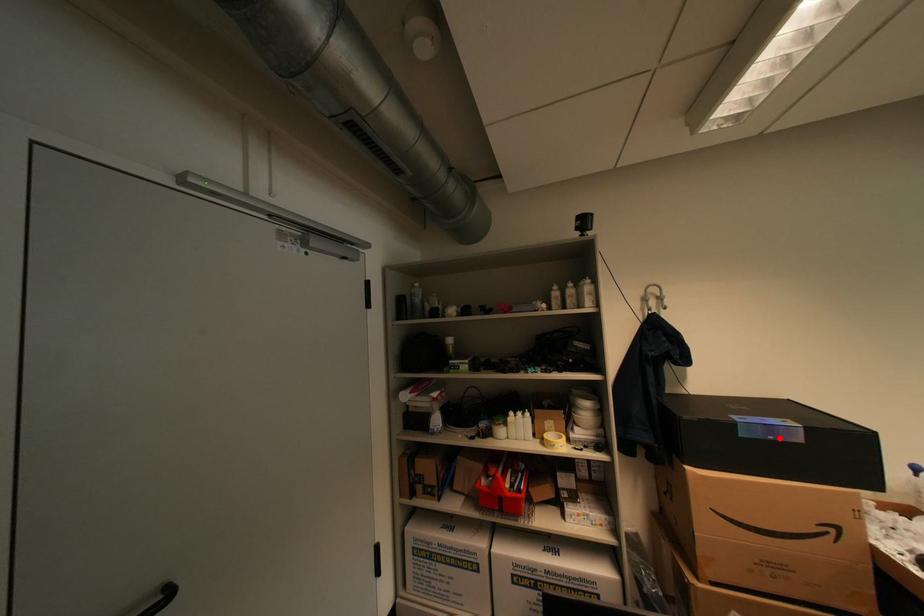
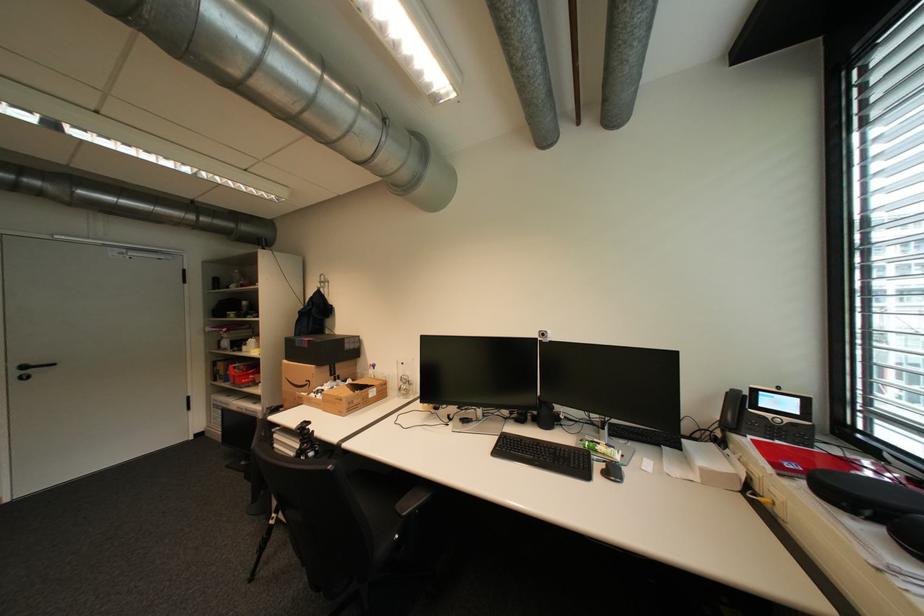
Question: I am providing you with two images of the same scene from different viewpoints. A red point is marked on the first image. Is the red point's position out of view in image 2?

Choices:
 (A) Yes
 (B) No

Answer: (B)